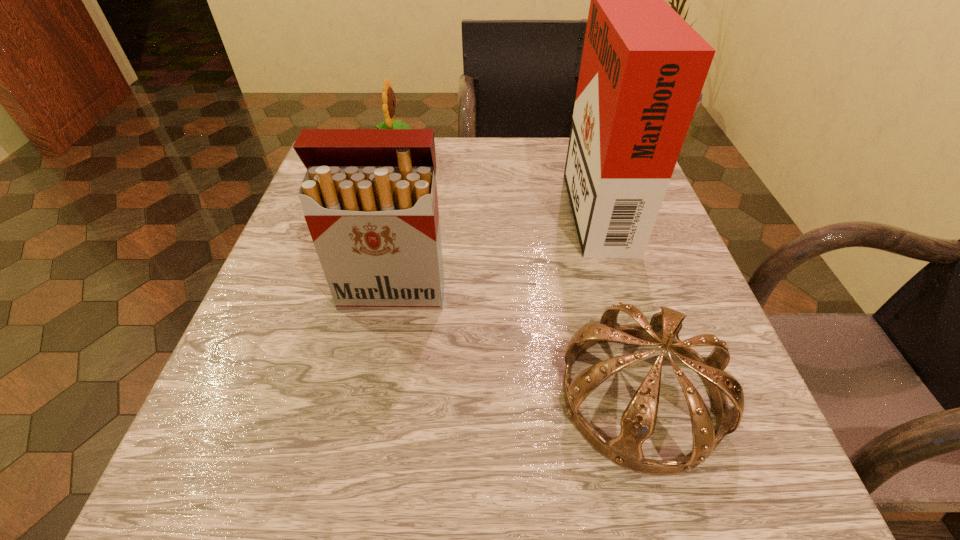
Image resolution: width=960 pixels, height=540 pixels. In order to click on vacant point that satisfies the following two spatial constraints: 1. on the front-facing side of the right cigarette case; 2. with the lid open on the left cigarette case in this screenshot , I will do `click(623, 293)`.